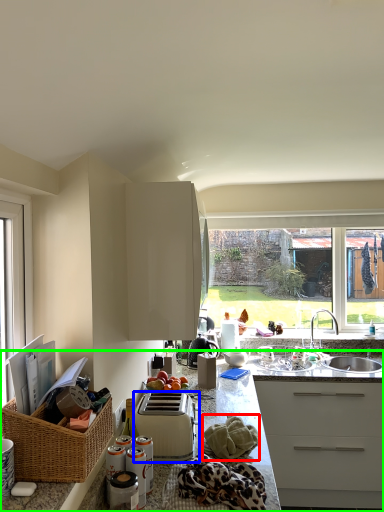
Question: Which object is positioned closest to material (highlighted by a red box)? Select from toaster (highlighted by a blue box) and countertop (highlighted by a green box).

Choices:
 (A) toaster
 (B) countertop

Answer: (A)